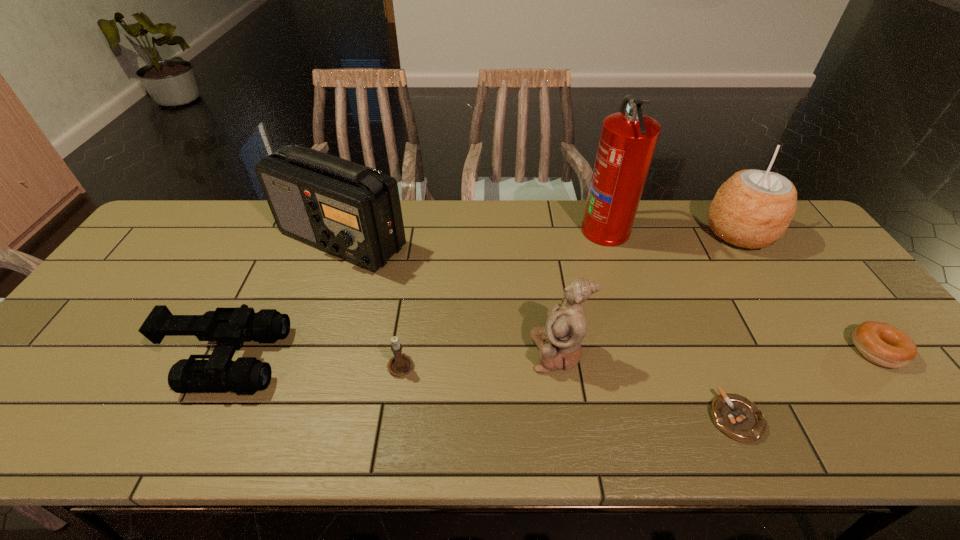
The width and height of the screenshot is (960, 540). Find the location of `bagel at the right edge`. bagel at the right edge is located at coordinates (882, 344).

Where is `object at the far right corner`? The image size is (960, 540). object at the far right corner is located at coordinates (752, 209).

What are the coordinates of `free space at the far edge of the desktop` in the screenshot? It's located at (653, 225).

In the image, there is a desktop. Where is `vacant space at the near edge`? vacant space at the near edge is located at coordinates (586, 421).

Find the location of a particular element. The image size is (960, 540). free space at the right edge of the desktop is located at coordinates (811, 302).

The height and width of the screenshot is (540, 960). In the image, there is a desktop. In order to click on vacant area at the far left corner in this screenshot , I will do `click(168, 232)`.

You are a GUI agent. You are given a task and a screenshot of the screen. Output one action in this format:
    pyautogui.click(x=<x>, y=<y>)
    Task: Click on the free space between the radio receiver and the figurine
    
    Given the screenshot: What is the action you would take?
    pyautogui.click(x=450, y=296)

Where is `free space between the bagel and the fourth object from left to right`? free space between the bagel and the fourth object from left to right is located at coordinates (717, 351).

At what (x,y) coordinates should I click in order to perform the action: click on unoccupied position between the fourth object from right to left and the fifth tallest object. Please return your answer as a coordinate pair (x, y). Looking at the image, I should click on (418, 294).

Identify the location of empty location between the sixth tallest object and the radio receiver. (372, 302).